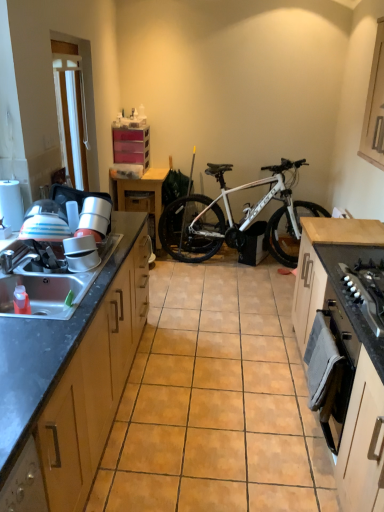
Question: Does silver metallic sink at left come behind wooden cabinet at upper right, arranged as the first cabinetry when viewed from the right?

Choices:
 (A) yes
 (B) no

Answer: (B)

Question: Are silver metallic sink at left and wooden cabinet at upper right, the 5th cabinetry in the left-to-right sequence, far apart?

Choices:
 (A) no
 (B) yes

Answer: (B)

Question: Does silver metallic sink at left have a lesser width compared to wooden cabinet at upper right, the 5th cabinetry in the left-to-right sequence?

Choices:
 (A) yes
 (B) no

Answer: (B)

Question: Is silver metallic sink at left to the left of wooden cabinet at upper right, the 5th cabinetry in the left-to-right sequence, from the viewer's perspective?

Choices:
 (A) yes
 (B) no

Answer: (A)

Question: Considering the relative sizes of silver metallic sink at left and wooden cabinet at upper right, the 5th cabinetry in the left-to-right sequence, in the image provided, is silver metallic sink at left smaller than wooden cabinet at upper right, the 5th cabinetry in the left-to-right sequence,?

Choices:
 (A) no
 (B) yes

Answer: (B)

Question: Is the position of silver metallic sink at left less distant than that of wooden cabinet at upper right, the 5th cabinetry in the left-to-right sequence?

Choices:
 (A) no
 (B) yes

Answer: (B)

Question: From the image's perspective, does wooden drawer at center appear higher than translucent plastic drawers at upper center, arranged as the fourth cabinetry when viewed from the right?

Choices:
 (A) yes
 (B) no

Answer: (B)

Question: Is wooden drawer at center directly adjacent to translucent plastic drawers at upper center, the 2th cabinetry from the left?

Choices:
 (A) yes
 (B) no

Answer: (B)

Question: Is wooden drawer at center facing towards translucent plastic drawers at upper center, the 2th cabinetry from the left?

Choices:
 (A) no
 (B) yes

Answer: (A)

Question: Considering the relative positions of wooden drawer at center and translucent plastic drawers at upper center, arranged as the fourth cabinetry when viewed from the right, in the image provided, is wooden drawer at center to the right of translucent plastic drawers at upper center, arranged as the fourth cabinetry when viewed from the right, from the viewer's perspective?

Choices:
 (A) yes
 (B) no

Answer: (A)

Question: From a real-world perspective, is wooden drawer at center over translucent plastic drawers at upper center, arranged as the fourth cabinetry when viewed from the right?

Choices:
 (A) no
 (B) yes

Answer: (A)

Question: Is wooden drawer at center located outside translucent plastic drawers at upper center, the 2th cabinetry from the left?

Choices:
 (A) no
 (B) yes

Answer: (B)

Question: From a real-world perspective, is white metallic bicycle at center beneath brushed metal faucet at sink left?

Choices:
 (A) no
 (B) yes

Answer: (B)